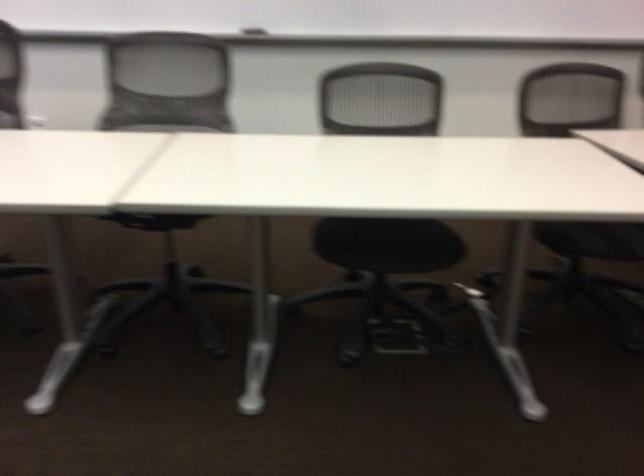
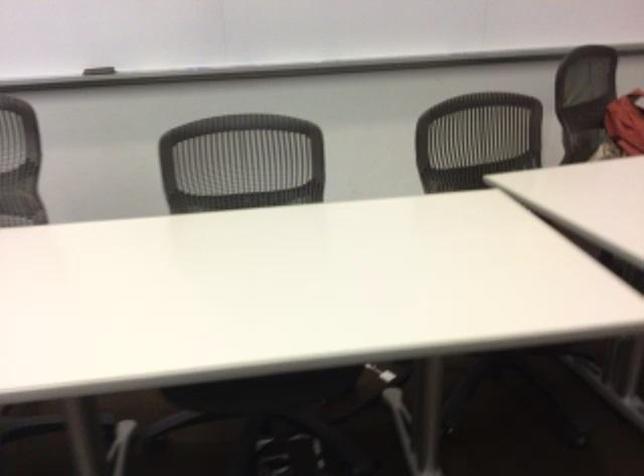
What movement of the cameraman would produce the second image?

The cameraman walked toward right, forward.